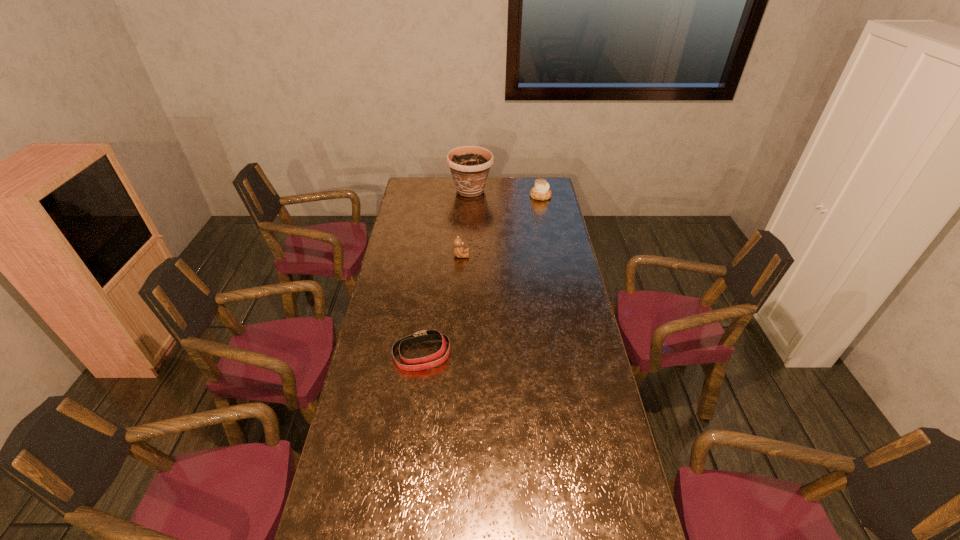
Find the location of a particular element. This screenshot has width=960, height=540. unoccupied area between the tallest object and the rightmost object is located at coordinates (506, 193).

What are the coordinates of `free point between the flowerpot and the teddy bear` in the screenshot? It's located at (466, 223).

The width and height of the screenshot is (960, 540). What are the coordinates of `free area in between the tallest object and the second nearest object` in the screenshot? It's located at (466, 223).

Where is `free spot between the tallest object and the shortest object`? The image size is (960, 540). free spot between the tallest object and the shortest object is located at coordinates (446, 273).

Identify the location of empty space between the rightmost object and the second nearest object. (501, 226).

Find the location of a particular element. This screenshot has width=960, height=540. free space between the teddy bear and the rightmost object is located at coordinates pos(501,226).

Identify the location of free space between the rightmost object and the third farthest object. (501, 226).

This screenshot has height=540, width=960. I want to click on object that is the nearest to the teddy bear, so click(469, 165).

Identify which object is the second closest to the pastry. Please provide its 2D coordinates. Your answer should be formatted as a tuple, i.e. [(x, y)], where the tuple contains the x and y coordinates of a point satisfying the conditions above.

[(458, 249)]

The height and width of the screenshot is (540, 960). Find the location of `vacant area in the image that satisfies the following two spatial constraints: 1. on the back side of the rightmost object; 2. on the right side of the dog collar`. vacant area in the image that satisfies the following two spatial constraints: 1. on the back side of the rightmost object; 2. on the right side of the dog collar is located at coordinates (442, 196).